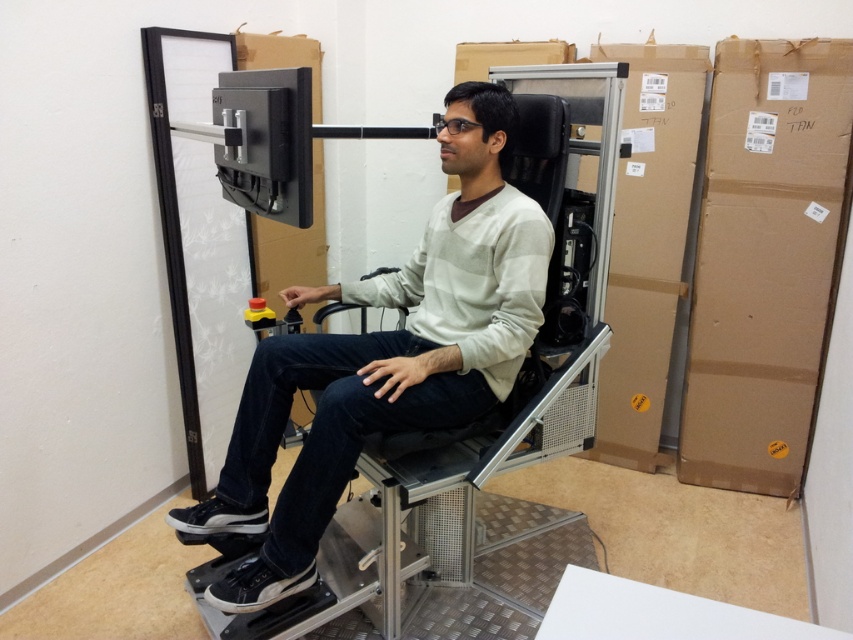
From the picture: You are a delivery person who needs to move the brown cardboard box at right to the storage room. The matte gray chair at center is blocking the path. Can you move the chair to the side to make space?

The matte gray chair at center is in front of the brown cardboard box at right, so you can move the chair to the side to create space for moving the box.

You are helping to organize a storage room and need to move the brown cardboard box at right. The matte gray chair at center is in the way. Can you lift the box over the chair without moving the chair?

The matte gray chair at center is positioned under brown cardboard box at right, so you can lift the box over the chair without moving it since the chair is below the box.